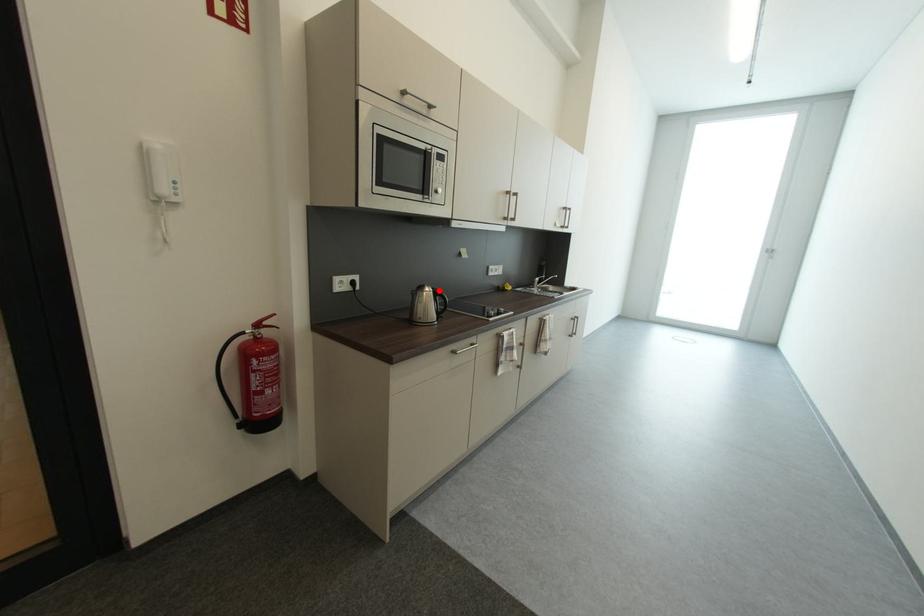
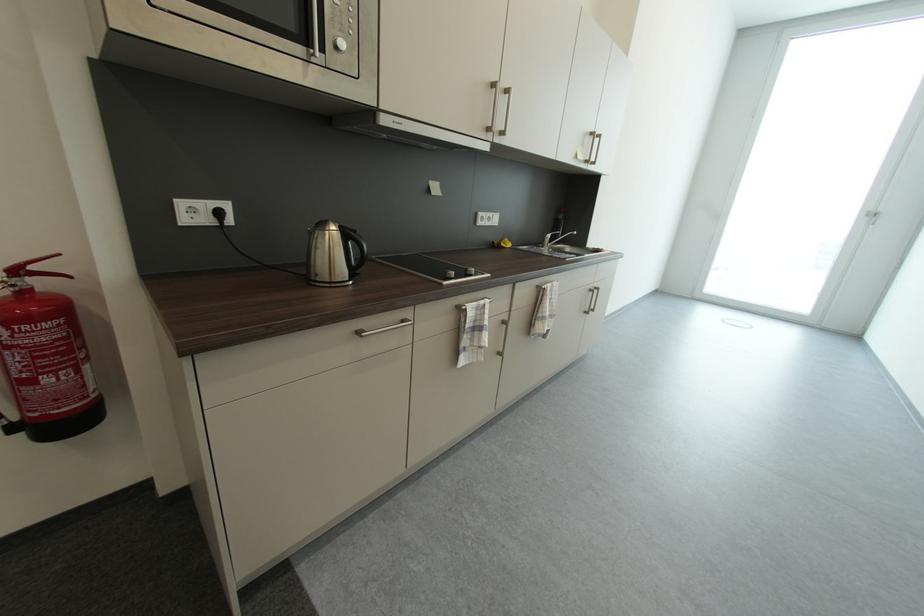
Locate, in the second image, the point that corresponds to the highlighted location in the first image.

(346, 228)